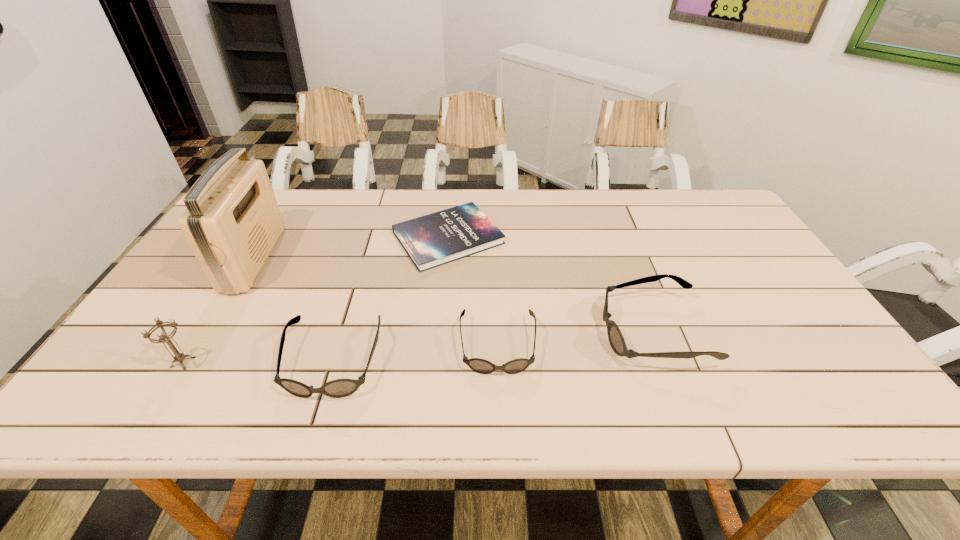
Identify the location of vacant spot to place a sunglasses on the right. The height and width of the screenshot is (540, 960). (798, 319).